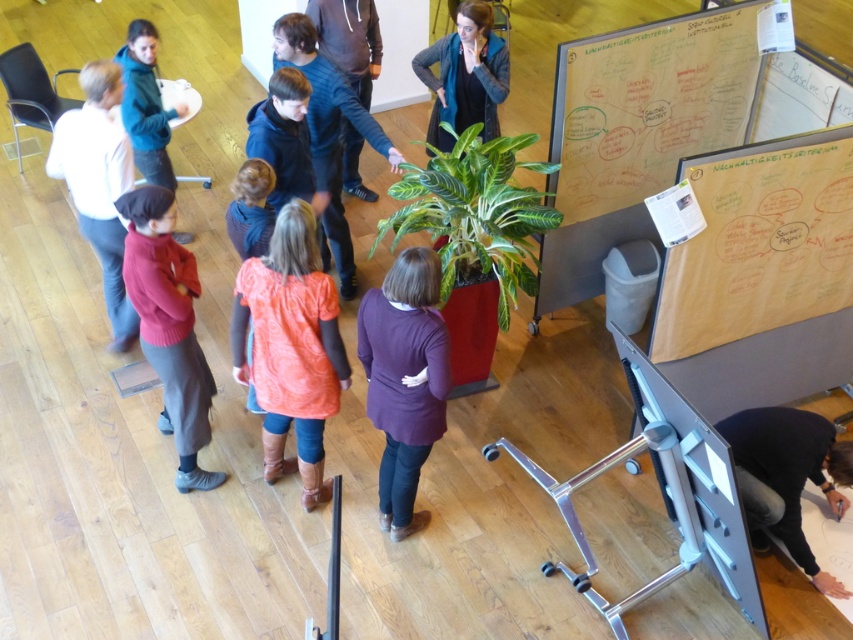
You are standing in the office and want to pick up the purple soft sweater at center and the dark blue sweater at center. Which one would you need to reach for first?

The purple soft sweater at center is closer to the viewer than the dark blue sweater at center, so you would need to reach for the purple soft sweater at center first.

You are standing at the entrance of the office and want to place a new potted plant exactly where the matte red sweater at center is currently located. Is this possible without moving the existing plant?

The matte red sweater at center is located at point (169, 324), which is a different position from the existing plant on the red stand. Therefore, you can place the new potted plant at the location of the matte red sweater at center without moving the existing plant.

You are standing in the office and want to determine which of the two points, point (190, 307) or point (102, 100), is nearer to you. Based on the scene description, which point is closer?

Point (190, 307) is closer to the viewer than point (102, 100).